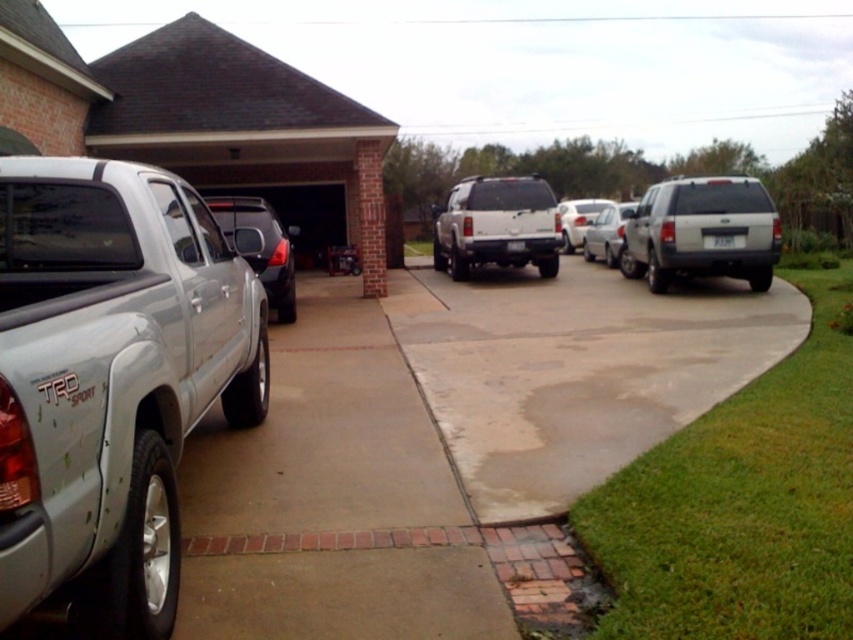
Between satin silver suv at center and white glossy sedan at center, which one appears on the left side from the viewer's perspective?

From the viewer's perspective, satin silver suv at center appears more on the left side.

Who is higher up, satin silver suv at center or white glossy sedan at center?

satin silver suv at center is above.

Find the location of a particular element. satin silver suv at center is located at coordinates [496, 225].

Who is positioned more to the left, silver metallic sedan at center-right or white glossy sedan at center?

From the viewer's perspective, silver metallic sedan at center-right appears more on the left side.

Can you confirm if silver metallic sedan at center-right is shorter than white glossy sedan at center?

Correct, silver metallic sedan at center-right is not as tall as white glossy sedan at center.

This screenshot has height=640, width=853. What are the coordinates of `silver metallic sedan at center-right` in the screenshot? It's located at (606, 234).

Find the location of a particular element. The height and width of the screenshot is (640, 853). silver metallic sedan at center-right is located at coordinates (606, 234).

Who is lower down, concrete at center or silver metallic sedan at center-right?

Positioned lower is concrete at center.

Consider the image. Is concrete at center below silver metallic sedan at center-right?

Correct, concrete at center is located below silver metallic sedan at center-right.

Describe the element at coordinates (575, 369) in the screenshot. I see `concrete at center` at that location.

I want to click on concrete at center, so click(x=575, y=369).